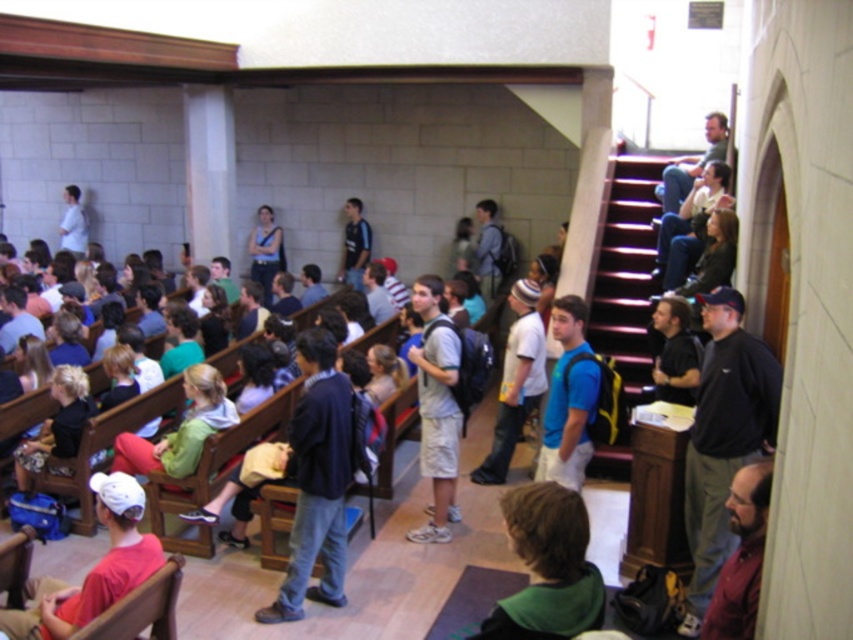
Which is below, wooden stairs at upper right or green fabric shirt at lower center?

green fabric shirt at lower center is below.

Does point (590, 465) lie in front of point (583, 544)?

No, it is behind (583, 544).

Is point (636, 188) behind point (544, 616)?

Yes, it is behind point (544, 616).

Locate an element on the screen. wooden stairs at upper right is located at coordinates (627, 273).

The image size is (853, 640). I want to click on matte red cap at lower left, so click(91, 568).

Is matte red cap at lower left shorter than blue fabric backpack at center?

Yes.

The width and height of the screenshot is (853, 640). Describe the element at coordinates (91, 568) in the screenshot. I see `matte red cap at lower left` at that location.

Image resolution: width=853 pixels, height=640 pixels. In order to click on matte red cap at lower left in this screenshot , I will do `click(91, 568)`.

Between wooden stairs at upper right and blue fabric backpack at center, which one appears on the left side from the viewer's perspective?

From the viewer's perspective, blue fabric backpack at center appears more on the left side.

This screenshot has height=640, width=853. Describe the element at coordinates (627, 273) in the screenshot. I see `wooden stairs at upper right` at that location.

Which is behind, point (599, 337) or point (581, 433)?

Point (599, 337)

Identify the location of wooden stairs at upper right. (627, 273).